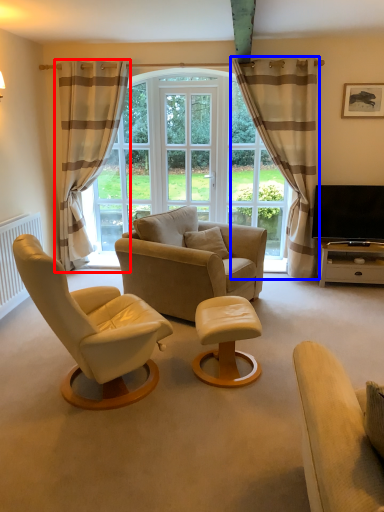
Question: Which object appears closest to the camera in this image, curtain (highlighted by a red box) or curtain (highlighted by a blue box)?

Choices:
 (A) curtain
 (B) curtain

Answer: (B)